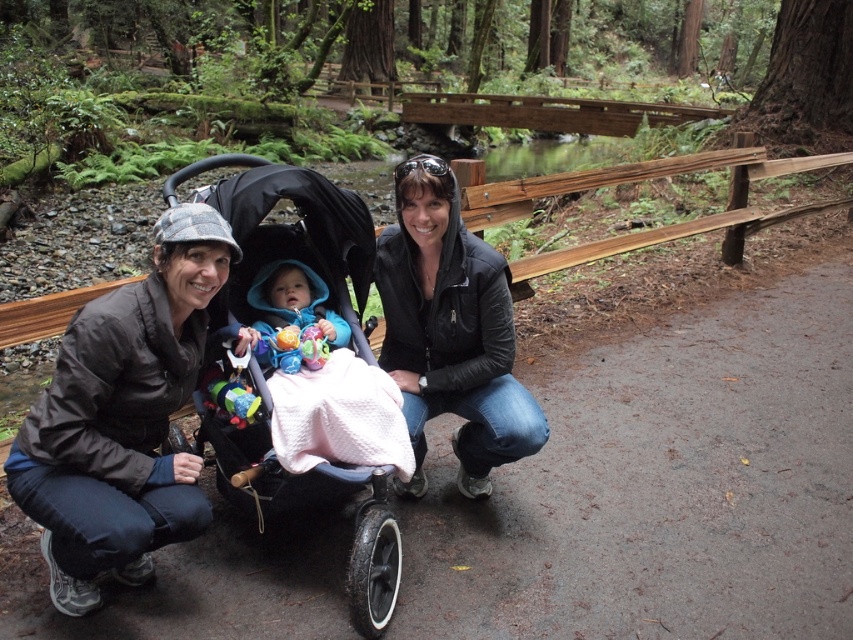
Between point (335, 198) and point (310, 310), which one is positioned behind?

Positioned behind is point (310, 310).

Between black matte stroller at center and blue fleece jacket at center, which one appears on the left side from the viewer's perspective?

From the viewer's perspective, black matte stroller at center appears more on the left side.

This screenshot has height=640, width=853. Describe the element at coordinates (271, 368) in the screenshot. I see `black matte stroller at center` at that location.

You are a GUI agent. You are given a task and a screenshot of the screen. Output one action in this format:
    pyautogui.click(x=<x>, y=<y>)
    Task: Click on the black matte stroller at center
    
    Given the screenshot: What is the action you would take?
    pyautogui.click(x=271, y=368)

Is point (204, 253) behind point (494, 344)?

No, it is not.

Does brown matte jacket at lower left have a larger size compared to black leather jacket at center?

Incorrect, brown matte jacket at lower left is not larger than black leather jacket at center.

The width and height of the screenshot is (853, 640). What are the coordinates of `brown matte jacket at lower left` in the screenshot? It's located at (122, 419).

At what (x,y) coordinates should I click in order to perform the action: click on brown matte jacket at lower left. Please return your answer as a coordinate pair (x, y). Image resolution: width=853 pixels, height=640 pixels. Looking at the image, I should click on (122, 419).

Is point (480, 385) closer to camera compared to point (303, 317)?

No, (480, 385) is behind (303, 317).

Where is `black leather jacket at center`? black leather jacket at center is located at coordinates pyautogui.click(x=450, y=332).